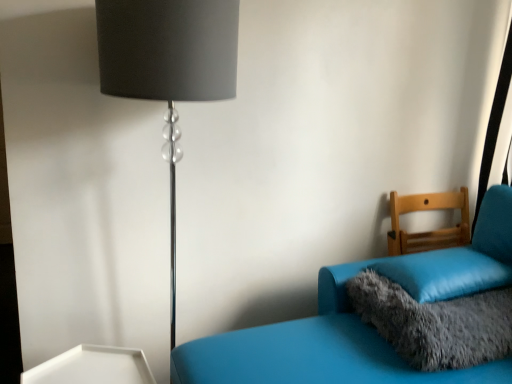
Question: Is fluffy gray pillow at lower right, the 1th pillow when ordered from bottom to top, at the back of soft blue pillow at right, the first pillow viewed from the top?

Choices:
 (A) no
 (B) yes

Answer: (A)

Question: Could you tell me if soft blue pillow at right, marked as the second pillow in a bottom-to-top arrangement, is facing fluffy gray pillow at lower right, which is the second pillow from top to bottom?

Choices:
 (A) no
 (B) yes

Answer: (A)

Question: Is soft blue pillow at right, the first pillow viewed from the top, closer to camera compared to fluffy gray pillow at lower right, which is the second pillow from top to bottom?

Choices:
 (A) yes
 (B) no

Answer: (B)

Question: Considering the relative sizes of soft blue pillow at right, the first pillow viewed from the top, and fluffy gray pillow at lower right, which is the second pillow from top to bottom, in the image provided, is soft blue pillow at right, the first pillow viewed from the top, bigger than fluffy gray pillow at lower right, which is the second pillow from top to bottom,?

Choices:
 (A) no
 (B) yes

Answer: (A)

Question: Is soft blue pillow at right, the first pillow viewed from the top, outside of fluffy gray pillow at lower right, which is the second pillow from top to bottom?

Choices:
 (A) no
 (B) yes

Answer: (B)

Question: Can fluffy gray pillow at lower right, which is the second pillow from top to bottom, be found inside soft blue pillow at right, marked as the second pillow in a bottom-to-top arrangement?

Choices:
 (A) no
 (B) yes

Answer: (A)

Question: Is matte blue couch at right, which is the first furniture in front-to-back order, positioned far away from black metallic lamp at left?

Choices:
 (A) yes
 (B) no

Answer: (B)

Question: Does matte blue couch at right, acting as the second furniture starting from the back, have a lesser height compared to black metallic lamp at left?

Choices:
 (A) yes
 (B) no

Answer: (A)

Question: From a real-world perspective, is matte blue couch at right, which is the first furniture in front-to-back order, positioned under black metallic lamp at left based on gravity?

Choices:
 (A) no
 (B) yes

Answer: (B)

Question: Is matte blue couch at right, which is the first furniture in front-to-back order, next to black metallic lamp at left and touching it?

Choices:
 (A) no
 (B) yes

Answer: (A)

Question: Is black metallic lamp at left a part of matte blue couch at right, which is the first furniture in front-to-back order?

Choices:
 (A) yes
 (B) no

Answer: (B)

Question: Is matte blue couch at right, acting as the second furniture starting from the back, aimed at black metallic lamp at left?

Choices:
 (A) yes
 (B) no

Answer: (A)

Question: Is fluffy gray pillow at lower right, which is the second pillow from top to bottom, next to soft blue pillow at right, marked as the second pillow in a bottom-to-top arrangement, and touching it?

Choices:
 (A) no
 (B) yes

Answer: (A)